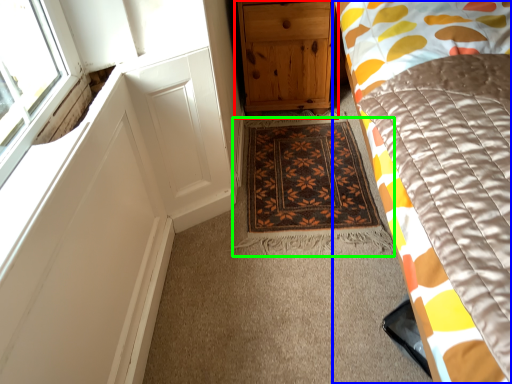
Question: Which object is positioned closest to chest of drawers (highlighted by a red box)? Select from bed (highlighted by a blue box) and mat (highlighted by a green box).

Choices:
 (A) bed
 (B) mat

Answer: (B)